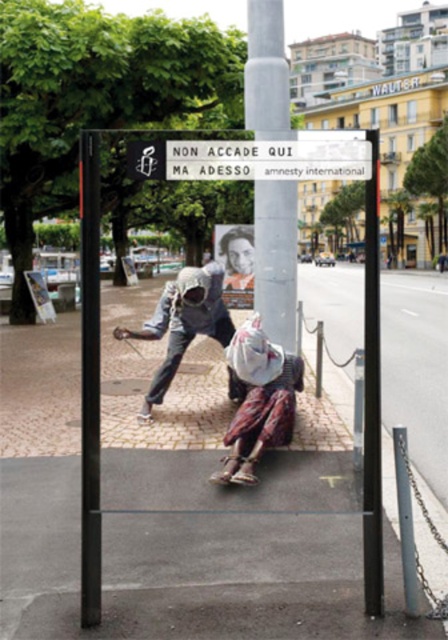
You are standing in front of the bus stop shelter and want to take a photo of the advertisement. You notice two points on the advertisement at coordinates point (242, 358) and point (241, 236). Which point will appear closer to you in the photo?

Point (242, 358) is closer to the camera than point (241, 236), so it will appear closer to you in the photo.

You are an art student analyzing the advertisement at the bus stop. You notice two elements in the image. The first is the rustic fabric bag at lower center and the second is the smooth skin portrait at center. Which of these two elements is bigger in size?

The rustic fabric bag at lower center has a larger size compared to the smooth skin portrait at center.

From the picture: You are standing at the point labeled as point (275,388) in the image. If you want to take a photo of the bus stop shelter with your camera, which is 5.29 meters away from you, where should you position yourself to capture the entire shelter in one shot?

You should position yourself at point (275,388) since the camera is 5.29 meters away from this point, allowing you to capture the entire shelter in one shot.